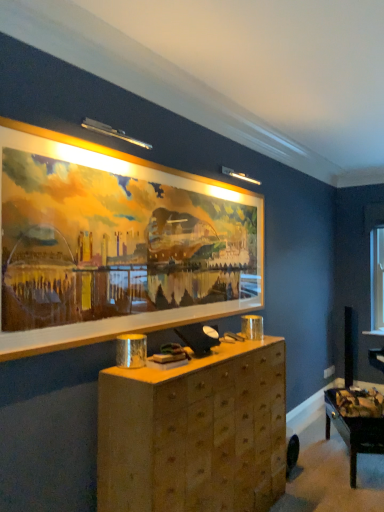
Looking at this image, measure the distance between wooden chest of drawers at center and camera.

wooden chest of drawers at center is 6.20 feet from camera.

The width and height of the screenshot is (384, 512). What do you see at coordinates (354, 432) in the screenshot?
I see `wooden table at lower right` at bounding box center [354, 432].

From the picture: Measure the distance between point (187, 177) and camera.

Point (187, 177) and camera are 2.75 meters apart from each other.

Image resolution: width=384 pixels, height=512 pixels. Identify the location of wooden chest of drawers at center. (195, 432).

How different are the orientations of wooden picture frame at upper center and transparent glass window at upper right in degrees?

wooden picture frame at upper center and transparent glass window at upper right are facing 90.3 degrees away from each other.

From a real-world perspective, is wooden picture frame at upper center beneath transparent glass window at upper right?

No, from a real-world perspective, wooden picture frame at upper center is not under transparent glass window at upper right.

Considering the relative sizes of wooden picture frame at upper center and transparent glass window at upper right in the image provided, is wooden picture frame at upper center taller than transparent glass window at upper right?

In fact, wooden picture frame at upper center may be shorter than transparent glass window at upper right.

Is wooden picture frame at upper center closer to the viewer compared to transparent glass window at upper right?

That is True.

What's the angular difference between wooden chest of drawers at center and wooden picture frame at upper center's facing directions?

The facing directions of wooden chest of drawers at center and wooden picture frame at upper center are 0.0336 degrees apart.

Is wooden chest of drawers at center not close to wooden picture frame at upper center?

No, wooden chest of drawers at center is in close proximity to wooden picture frame at upper center.

Is point (199, 403) behind point (180, 259)?

No, (199, 403) is in front of (180, 259).

Can you tell me how much wooden picture frame at upper center and wooden table at lower right differ in facing direction?

There is a 30.8-degree angle between the facing directions of wooden picture frame at upper center and wooden table at lower right.

Is wooden picture frame at upper center looking in the opposite direction of wooden table at lower right?

No, wooden picture frame at upper center is not facing the opposite direction of wooden table at lower right.

Locate an element on the screen. table that appears behind the wooden picture frame at upper center is located at coordinates (354, 432).

Is wooden table at lower right completely or partially inside wooden picture frame at upper center?

No, wooden table at lower right is not a part of wooden picture frame at upper center.

Identify the location of table below the wooden picture frame at upper center (from a real-world perspective). (354, 432).

How distant is wooden table at lower right from wooden picture frame at upper center?

A distance of 6.49 feet exists between wooden table at lower right and wooden picture frame at upper center.

Is wooden table at lower right positioned in front of wooden picture frame at upper center?

No, the depth of wooden table at lower right is greater than that of wooden picture frame at upper center.

Which of these two, wooden table at lower right or wooden picture frame at upper center, stands shorter?

With less height is wooden table at lower right.

Between wooden table at lower right and wooden chest of drawers at center, which one has smaller width?

wooden table at lower right.

From a real-world perspective, which object rests below the other?

wooden table at lower right, from a real-world perspective.

Between wooden table at lower right and wooden chest of drawers at center, which one appears on the right side from the viewer's perspective?

Positioned to the right is wooden table at lower right.

Identify the location of picture frame that is above the transparent glass window at upper right (from the image's perspective). This screenshot has width=384, height=512. (115, 243).

From the picture: Is transparent glass window at upper right in front of or behind wooden picture frame at upper center in the image?

transparent glass window at upper right is behind wooden picture frame at upper center.

Would you say transparent glass window at upper right is inside or outside wooden picture frame at upper center?

transparent glass window at upper right is not enclosed by wooden picture frame at upper center.

Considering the relative positions of wooden chest of drawers at center and transparent glass window at upper right in the image provided, is wooden chest of drawers at center to the left of transparent glass window at upper right from the viewer's perspective?

Yes, wooden chest of drawers at center is to the left of transparent glass window at upper right.

Does wooden chest of drawers at center come in front of transparent glass window at upper right?

Yes, wooden chest of drawers at center is closer to the camera.

From a real-world perspective, is wooden chest of drawers at center located higher than transparent glass window at upper right?

Incorrect, from a real-world perspective, wooden chest of drawers at center is lower than transparent glass window at upper right.

From the image's perspective, is wooden chest of drawers at center located above transparent glass window at upper right?

No.

Locate an element on the screen. This screenshot has height=512, width=384. window lying behind the wooden picture frame at upper center is located at coordinates coord(377,278).

In order to click on the chest of drawers beneath the wooden picture frame at upper center (from a real-world perspective) in this screenshot , I will do `click(195, 432)`.

Which object lies nearer to the anchor point wooden chest of drawers at center, wooden picture frame at upper center or wooden table at lower right?

wooden picture frame at upper center is closer to wooden chest of drawers at center.

Which object lies further to the anchor point wooden table at lower right, wooden chest of drawers at center or wooden picture frame at upper center?

Based on the image, wooden picture frame at upper center appears to be further to wooden table at lower right.

Considering their positions, is wooden chest of drawers at center positioned closer to wooden picture frame at upper center than transparent glass window at upper right?

Based on the image, wooden chest of drawers at center appears to be nearer to wooden picture frame at upper center.

Which object lies further to the anchor point wooden chest of drawers at center, transparent glass window at upper right or wooden picture frame at upper center?

transparent glass window at upper right is positioned further to the anchor wooden chest of drawers at center.

Looking at the image, which one is located further to wooden picture frame at upper center, transparent glass window at upper right or wooden table at lower right?

Among the two, transparent glass window at upper right is located further to wooden picture frame at upper center.

Estimate the real-world distances between objects in this image. Which object is closer to wooden chest of drawers at center, wooden picture frame at upper center or transparent glass window at upper right?

wooden picture frame at upper center is closer to wooden chest of drawers at center.

From the image, which object appears to be farther from transparent glass window at upper right, wooden table at lower right or wooden picture frame at upper center?

The object further to transparent glass window at upper right is wooden picture frame at upper center.

Estimate the real-world distances between objects in this image. Which object is further from transparent glass window at upper right, wooden table at lower right or wooden chest of drawers at center?

wooden chest of drawers at center is further to transparent glass window at upper right.

What are the coordinates of `table between wooden chest of drawers at center and transparent glass window at upper right in the front-back direction` in the screenshot? It's located at (354, 432).

Find the location of a particular element. Image resolution: width=384 pixels, height=512 pixels. chest of drawers between wooden picture frame at upper center and transparent glass window at upper right from front to back is located at coordinates (195, 432).

Locate an element on the screen. Image resolution: width=384 pixels, height=512 pixels. chest of drawers between wooden picture frame at upper center and wooden table at lower right from top to bottom is located at coordinates (195, 432).

The image size is (384, 512). Find the location of `table between wooden picture frame at upper center and transparent glass window at upper right along the z-axis`. table between wooden picture frame at upper center and transparent glass window at upper right along the z-axis is located at coordinates (354, 432).